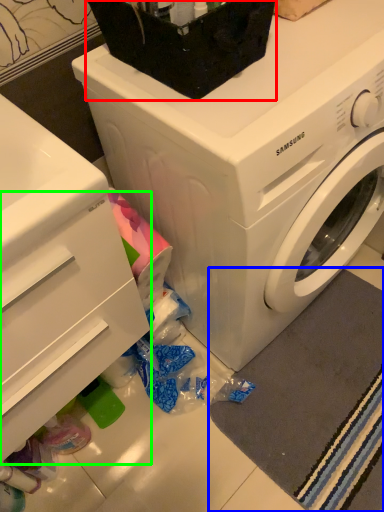
Question: Which object is positioned farthest from appliance (highlighted by a red box)? Select from bath mat (highlighted by a blue box) and drawer (highlighted by a green box).

Choices:
 (A) bath mat
 (B) drawer

Answer: (A)